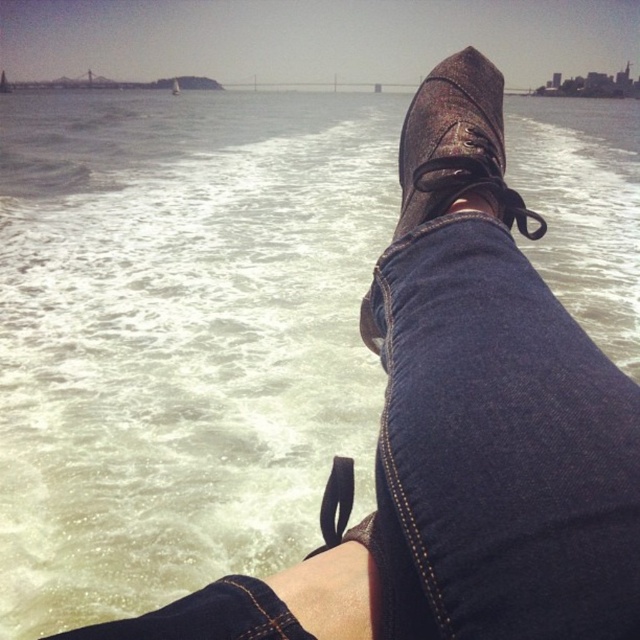
Is the position of leather boot at center more distant than that of white plastic sailboat at upper center?

No, leather boot at center is closer to the viewer.

Who is more distant from viewer, (429, 188) or (173, 92)?

The point (173, 92) is behind.

Measure the distance between point (454,147) and camera.

A distance of 36.17 inches exists between point (454,147) and camera.

Locate an element on the screen. The height and width of the screenshot is (640, 640). leather boot at center is located at coordinates (456, 145).